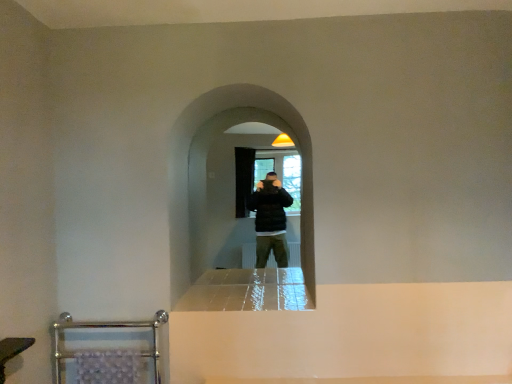
Question: Is black matte screen door at center aimed at chrome metallic towel rack at lower left?

Choices:
 (A) yes
 (B) no

Answer: (B)

Question: From the image's perspective, is black matte screen door at center over chrome metallic towel rack at lower left?

Choices:
 (A) no
 (B) yes

Answer: (B)

Question: Can you confirm if black matte screen door at center is positioned to the left of chrome metallic towel rack at lower left?

Choices:
 (A) no
 (B) yes

Answer: (A)

Question: Does black matte screen door at center have a smaller size compared to chrome metallic towel rack at lower left?

Choices:
 (A) no
 (B) yes

Answer: (A)

Question: Can you confirm if black matte screen door at center is taller than chrome metallic towel rack at lower left?

Choices:
 (A) yes
 (B) no

Answer: (A)

Question: Considering the relative sizes of black matte screen door at center and chrome metallic towel rack at lower left in the image provided, is black matte screen door at center bigger than chrome metallic towel rack at lower left?

Choices:
 (A) yes
 (B) no

Answer: (A)

Question: Is black matte screen door at center outside brushed metal towel rack at lower left?

Choices:
 (A) no
 (B) yes

Answer: (B)

Question: Can you confirm if black matte screen door at center is thinner than brushed metal towel rack at lower left?

Choices:
 (A) yes
 (B) no

Answer: (B)

Question: From the image's perspective, is black matte screen door at center over brushed metal towel rack at lower left?

Choices:
 (A) no
 (B) yes

Answer: (B)

Question: Can you confirm if black matte screen door at center is positioned to the left of brushed metal towel rack at lower left?

Choices:
 (A) no
 (B) yes

Answer: (A)

Question: Can you confirm if black matte screen door at center is bigger than brushed metal towel rack at lower left?

Choices:
 (A) yes
 (B) no

Answer: (A)

Question: Does black matte screen door at center lie behind brushed metal towel rack at lower left?

Choices:
 (A) yes
 (B) no

Answer: (A)

Question: Is chrome metallic towel rack at lower left outside of black matte screen door at center?

Choices:
 (A) no
 (B) yes

Answer: (B)